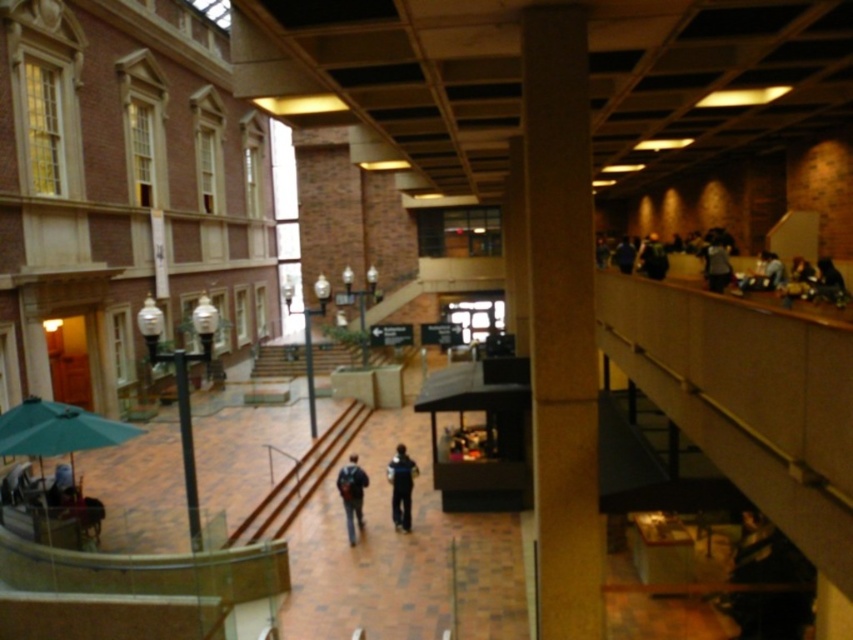
Is brown textured pillar at center in front of dark blue backpack at center?

Yes, brown textured pillar at center is closer to the viewer.

Where is `brown textured pillar at center`? brown textured pillar at center is located at coordinates (561, 321).

Which is more to the right, green fabric umbrella at lower left or dark blue jeans at center?

dark blue jeans at center is more to the right.

Is green fabric umbrella at lower left taller than dark blue jeans at center?

No.

Identify the location of green fabric umbrella at lower left. The height and width of the screenshot is (640, 853). (57, 429).

Between green fabric umbrella at lower left and dark gray fabric jacket at right, which one is positioned higher?

Positioned higher is dark gray fabric jacket at right.

Does green fabric umbrella at lower left appear over dark gray fabric jacket at right?

No, green fabric umbrella at lower left is not above dark gray fabric jacket at right.

Which is behind, point (83, 445) or point (679, 275)?

The point (679, 275) is behind.

At what (x,y) coordinates should I click in order to perform the action: click on green fabric umbrella at lower left. Please return your answer as a coordinate pair (x, y). Looking at the image, I should click on (57, 429).